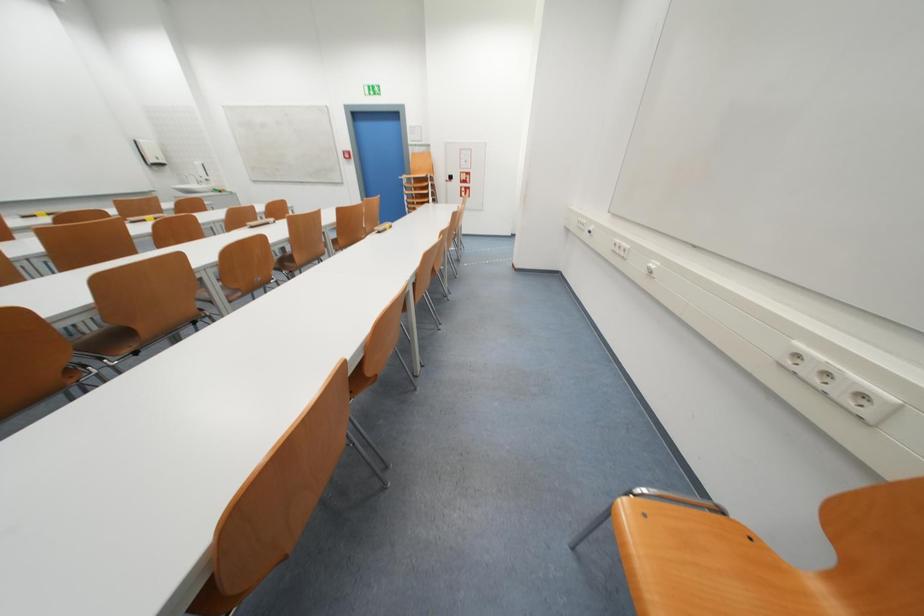
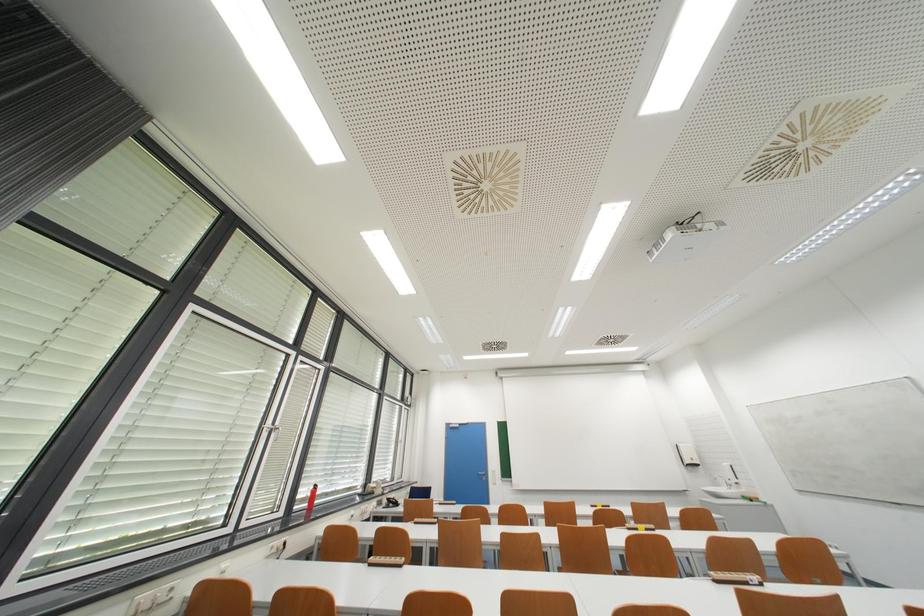
Based on the continuous images, in which direction is the camera rotating?

The camera rotated toward left-up.